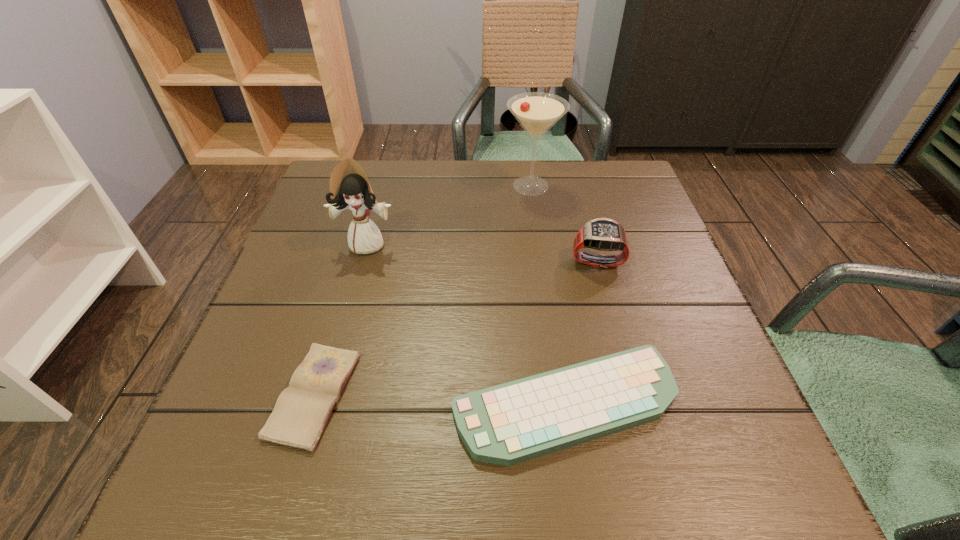
Where is `vacant position at the near edge of the desktop`? The image size is (960, 540). vacant position at the near edge of the desktop is located at coordinates (397, 457).

In order to click on free location at the right edge of the desktop in this screenshot , I will do `click(635, 253)`.

Image resolution: width=960 pixels, height=540 pixels. In the image, there is a desktop. What are the coordinates of `vacant space at the far right corner` in the screenshot? It's located at (633, 168).

Where is `vacant area at the near right corner of the desktop`? vacant area at the near right corner of the desktop is located at coordinates (692, 456).

This screenshot has height=540, width=960. What are the coordinates of `free space between the doll and the shortest object` in the screenshot? It's located at (341, 320).

You are a GUI agent. You are given a task and a screenshot of the screen. Output one action in this format:
    pyautogui.click(x=<x>, y=<y>)
    Task: Click on the free space between the watch and the diary
    Image resolution: width=960 pixels, height=540 pixels.
    Given the screenshot: What is the action you would take?
    pyautogui.click(x=456, y=328)

You are a GUI agent. You are given a task and a screenshot of the screen. Output one action in this format:
    pyautogui.click(x=<x>, y=<y>)
    Task: Click on the blank region between the third tallest object and the computer keyboard
    This screenshot has height=540, width=960.
    Given the screenshot: What is the action you would take?
    pyautogui.click(x=581, y=332)

I want to click on free spot between the computer keyboard and the watch, so click(581, 332).

At what (x,y) coordinates should I click in order to perform the action: click on empty space that is in between the fourth tallest object and the shortest object. Please return your answer as a coordinate pair (x, y). Looking at the image, I should click on (440, 400).

At what (x,y) coordinates should I click in order to perform the action: click on free point between the martini and the doll. Please return your answer as a coordinate pair (x, y). Image resolution: width=960 pixels, height=540 pixels. Looking at the image, I should click on (449, 215).